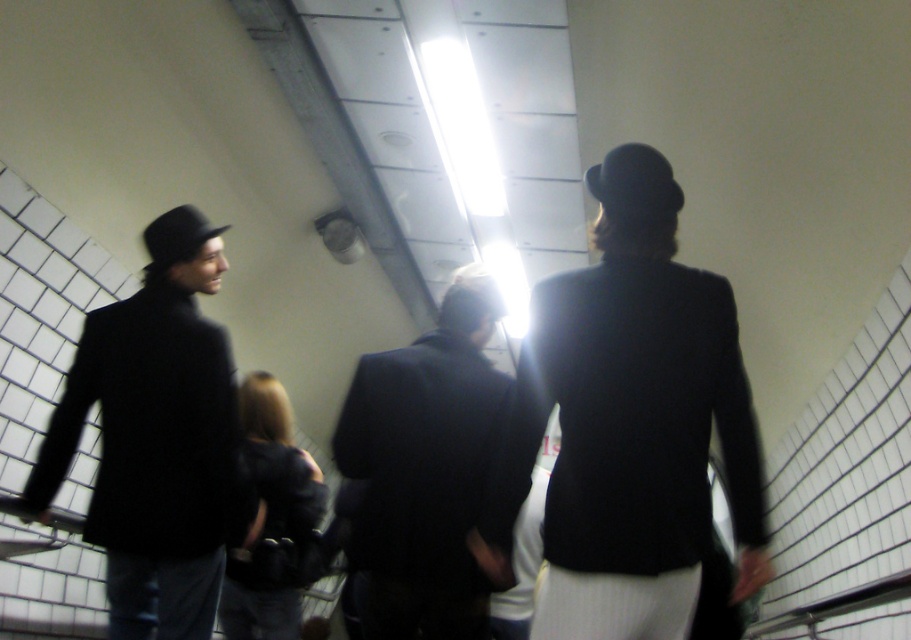
Question: Where is matte black coat at left located in relation to dark suit at center in the image?

Choices:
 (A) below
 (B) above

Answer: (B)

Question: Considering the real-world distances, which object is closest to the dark suit at center?

Choices:
 (A) matte black coat at left
 (B) matte black blazer at center

Answer: (B)

Question: Is matte black blazer at center above matte black coat at left?

Choices:
 (A) yes
 (B) no

Answer: (A)

Question: Which point is closer to the camera taking this photo?

Choices:
 (A) (283, 520)
 (B) (376, 536)
 (C) (586, 634)

Answer: (C)

Question: Which point is closer to the camera?

Choices:
 (A) matte black blazer at center
 (B) black leather jacket at center
 (C) dark suit at center
 (D) matte black coat at left

Answer: (A)

Question: Can you confirm if matte black blazer at center is positioned to the right of dark suit at center?

Choices:
 (A) no
 (B) yes

Answer: (B)